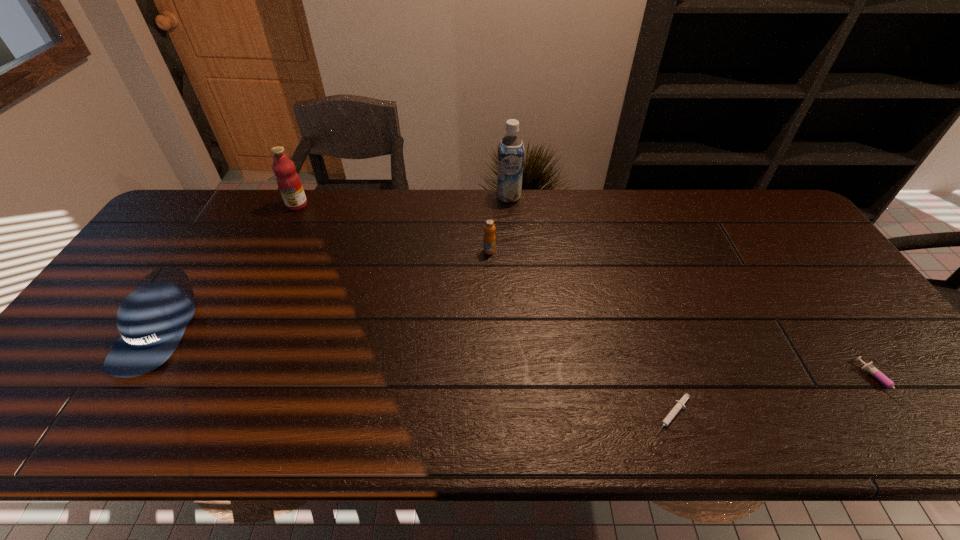
I want to click on free point that satisfies the following two spatial constraints: 1. on the label of the right syringe; 2. on the right side of the fifth object from right to left, so click(212, 383).

The width and height of the screenshot is (960, 540). I want to click on vacant point that satisfies the following two spatial constraints: 1. on the label of the fifth tallest object; 2. on the right side of the tallest object, so click(523, 383).

Where is `blank space that satisfies the following two spatial constraints: 1. on the front label of the left syringe; 2. on the right side of the fourth object from right to left`? blank space that satisfies the following two spatial constraints: 1. on the front label of the left syringe; 2. on the right side of the fourth object from right to left is located at coordinates (493, 415).